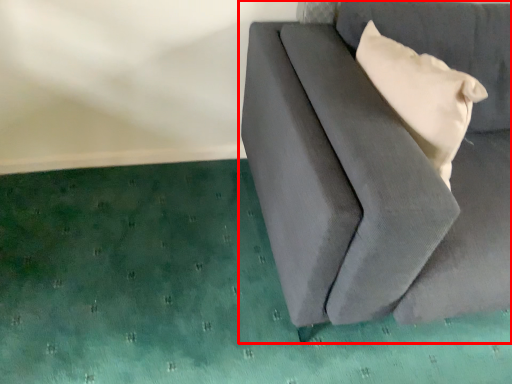
Question: From the image, what is the correct spatial relationship of furniture (annotated by the red box) in relation to pillow?

Choices:
 (A) right
 (B) left

Answer: (A)